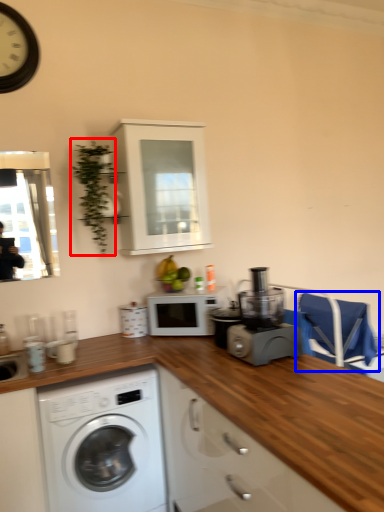
Question: Which object appears farthest to the camera in this image, plant (highlighted by a red box) or chair (highlighted by a blue box)?

Choices:
 (A) plant
 (B) chair

Answer: (B)